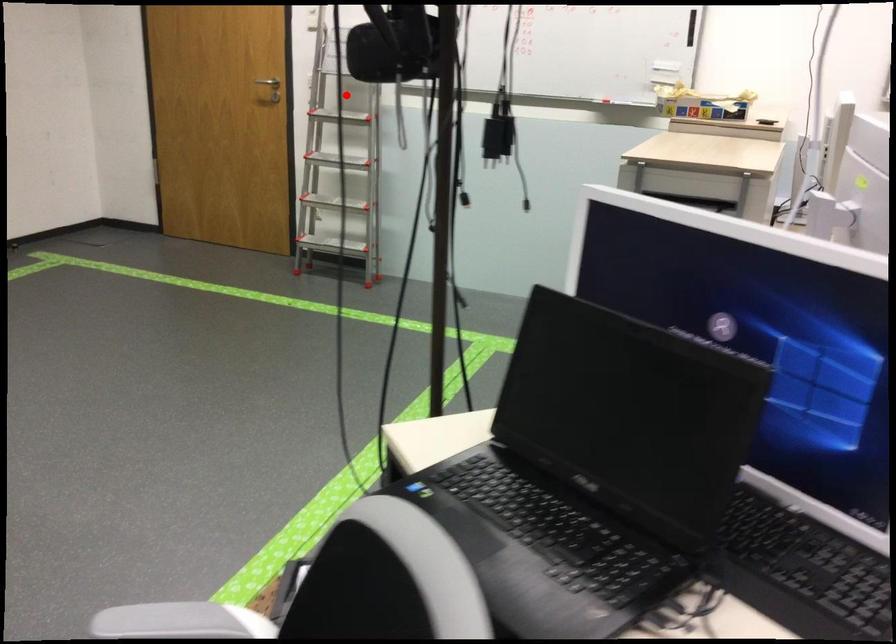
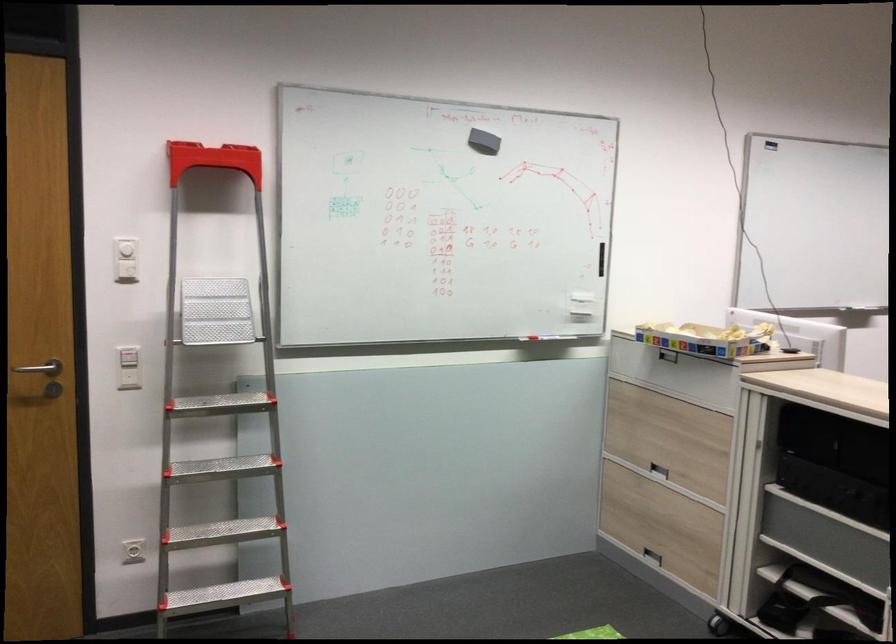
The point at the highlighted location is marked in the first image. Where is the corresponding point in the second image?

(128, 377)